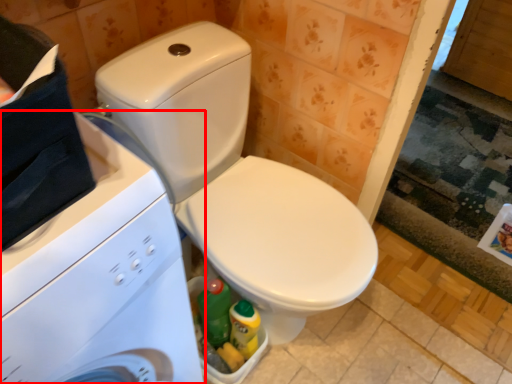
Question: From the image's perspective, what is the correct spatial positioning of washing machine (annotated by the red box) in reference to toilet?

Choices:
 (A) above
 (B) below

Answer: (B)